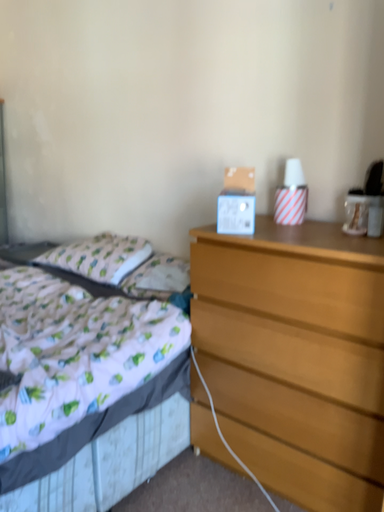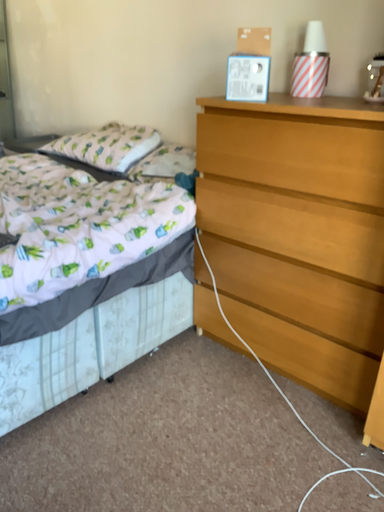
Question: How did the camera likely rotate when shooting the video?

Choices:
 (A) rotated upward
 (B) rotated downward

Answer: (B)